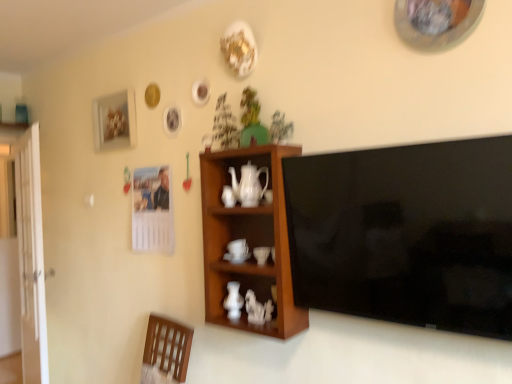
Question: Is green matte houseplant at upper center, placed as the second houseplant when sorted from right to left, taller or shorter than white glossy teapot at center?

Choices:
 (A) tall
 (B) short

Answer: (A)

Question: Looking at their shapes, would you say green matte houseplant at upper center, the 1th houseplant in the left-to-right sequence, is wider or thinner than white glossy teapot at center?

Choices:
 (A) thin
 (B) wide

Answer: (B)

Question: Estimate the real-world distances between objects in this image. Which object is closer to the green matte houseplant at upper center, placed as the second houseplant when sorted from right to left?

Choices:
 (A) wooden cabinet at center
 (B) black glossy flat-screen tv at right
 (C) white glossy door at left
 (D) green matte houseplant at upper center, the 2th houseplant in the left-to-right sequence
 (E) white glossy teapot at center

Answer: (D)

Question: Which is nearer to the white glossy coffee cup at center, which is the second coffee cup in left-to-right order?

Choices:
 (A) green matte houseplant at upper center, the 1th houseplant in the left-to-right sequence
 (B) white glossy door at left
 (C) white glossy vase at center
 (D) matte white picture frame at upper left
 (E) white glossy teapot at center

Answer: (E)